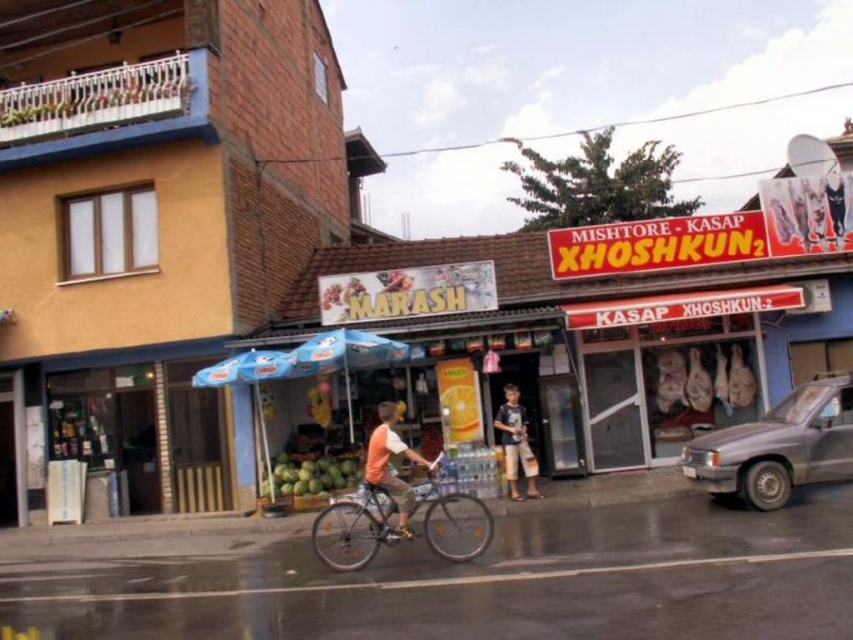
Is point (447, 557) positioned in front of point (521, 449)?

Yes, it is.

The image size is (853, 640). Identify the location of silver metallic bicycle at center. (354, 528).

Does dirty metallic car at right appear over orange cotton shirt at center?

Indeed, dirty metallic car at right is positioned over orange cotton shirt at center.

Who is lower down, dirty metallic car at right or orange cotton shirt at center?

orange cotton shirt at center

Is point (776, 461) farther from viewer compared to point (387, 442)?

That is True.

Identify the location of dirty metallic car at right. (778, 445).

Is dirty metallic car at right smaller than silver metallic bicycle at center?

Yes, dirty metallic car at right is smaller than silver metallic bicycle at center.

Who is more distant from viewer, [851,400] or [376,496]?

Positioned behind is point [851,400].

This screenshot has width=853, height=640. Identify the location of dirty metallic car at right. (778, 445).